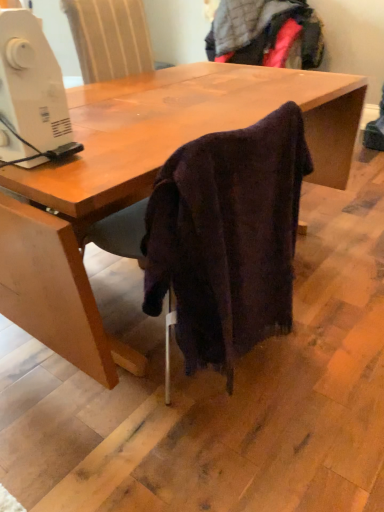
Locate an element on the screen. The image size is (384, 512). vacant area that lies to the right of dark woolen sweater at lower center is located at coordinates (324, 341).